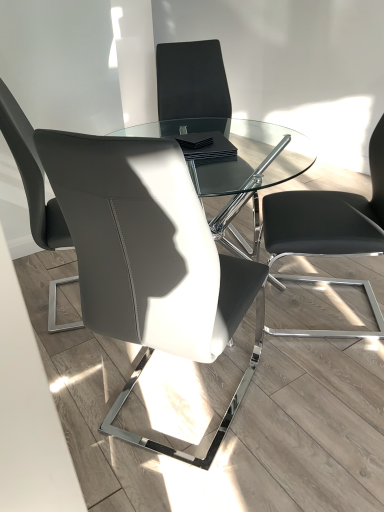
This screenshot has height=512, width=384. In order to click on free space in front of black leather chair at right, arranged as the fourth chair when viewed from the left in this screenshot , I will do `click(321, 380)`.